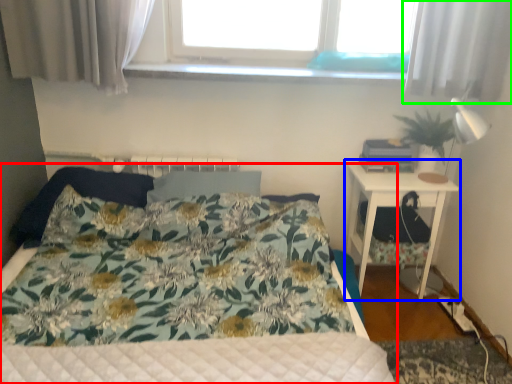
Question: Which object is the closest to the bed (highlighted by a red box)? Choose among these: nightstand (highlighted by a blue box) or curtain (highlighted by a green box).

Choices:
 (A) nightstand
 (B) curtain

Answer: (A)